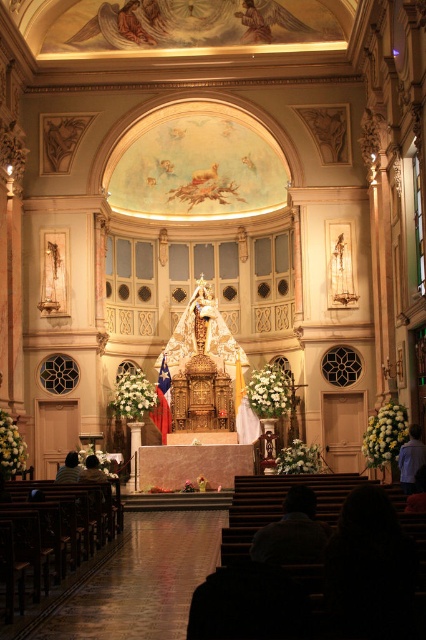
Which is above, blue fabric shirt at lower right or dark brown hair at lower left?

blue fabric shirt at lower right is above.

Is point (420, 435) more distant than point (104, 477)?

No, it is not.

What do you see at coordinates (411, 458) in the screenshot? I see `blue fabric shirt at lower right` at bounding box center [411, 458].

This screenshot has width=426, height=640. I want to click on blue fabric shirt at lower right, so click(x=411, y=458).

Who is more distant from viewer, (74, 456) or (89, 470)?

The point (89, 470) is more distant.

Can you confirm if dark brown leather jacket at lower left is smaller than dark brown hair at lower left?

Result: No.

Locate an element on the screen. dark brown leather jacket at lower left is located at coordinates point(69,468).

Describe the element at coordinates (411, 458) in the screenshot. The image size is (426, 640). I see `blue fabric shirt at lower right` at that location.

Between blue fabric shirt at lower right and dark brown leather jacket at lower left, which one is positioned lower?

dark brown leather jacket at lower left

Which is behind, point (411, 451) or point (66, 460)?

The point (66, 460) is more distant.

The width and height of the screenshot is (426, 640). I want to click on blue fabric shirt at lower right, so click(x=411, y=458).